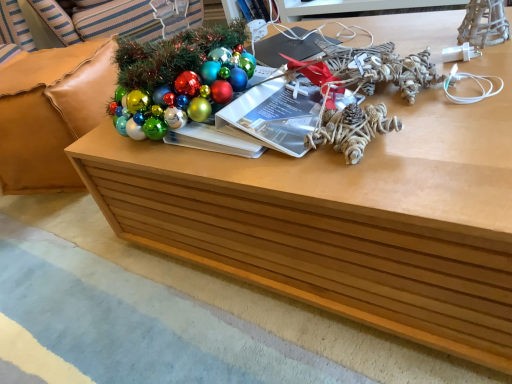
This screenshot has height=384, width=512. Describe the element at coordinates (51, 113) in the screenshot. I see `brown leather couch at left` at that location.

This screenshot has width=512, height=384. In order to click on brown leather couch at left in this screenshot , I will do [x=51, y=113].

Where is `brown leather couch at left`? The width and height of the screenshot is (512, 384). brown leather couch at left is located at coordinates (51, 113).